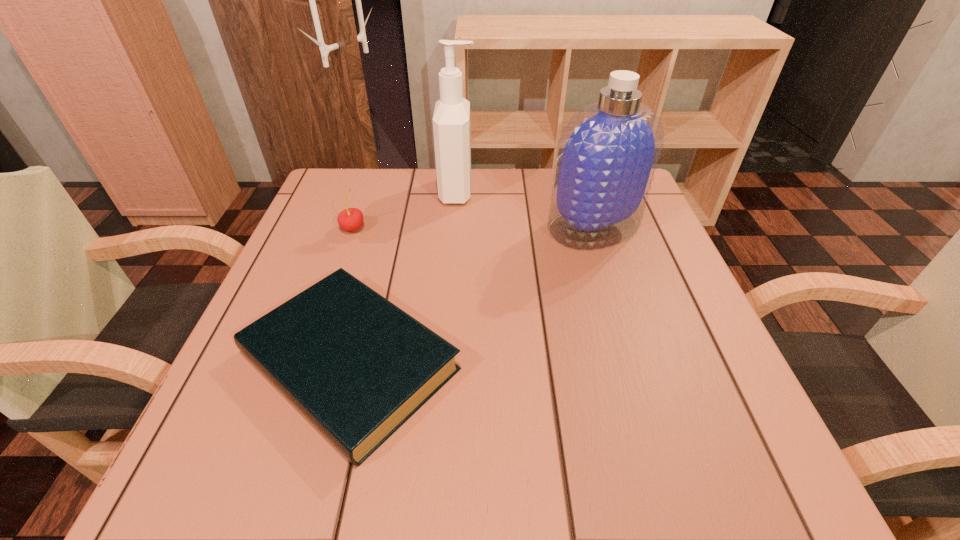
You are a GUI agent. You are given a task and a screenshot of the screen. Output one action in this format:
    pyautogui.click(x=<x>, y=<y>)
    Task: Click on the left cleansing agent
    This screenshot has width=960, height=540.
    Given the screenshot: What is the action you would take?
    pyautogui.click(x=451, y=121)

Where is `the rightmost object`? Image resolution: width=960 pixels, height=540 pixels. the rightmost object is located at coordinates [x=607, y=154].

At what (x,y) coordinates should I click in order to perform the action: click on cherry. Please return your answer as a coordinate pair (x, y). Image resolution: width=960 pixels, height=540 pixels. Looking at the image, I should click on (350, 219).

Locate an element on the screen. Image resolution: width=960 pixels, height=540 pixels. the shortest object is located at coordinates (357, 366).

Image resolution: width=960 pixels, height=540 pixels. I want to click on book, so click(x=357, y=366).

You are a GUI agent. You are given a task and a screenshot of the screen. Output one action in this format:
    pyautogui.click(x=<x>, y=<y>)
    Task: Click on the free space located on the front label of the left cleansing agent
    The height and width of the screenshot is (540, 960).
    Given the screenshot: What is the action you would take?
    pyautogui.click(x=523, y=191)

Find the location of a particular element. The height and width of the screenshot is (540, 960). vacant space located 0.070m on the left of the rightmost object is located at coordinates (515, 227).

This screenshot has width=960, height=540. Identify the location of free space located on the right of the third tallest object. (406, 228).

Find the location of a particular element. free space located 0.370m on the back of the shortest object is located at coordinates (396, 184).

The width and height of the screenshot is (960, 540). What are the coordinates of `cherry present at the far edge` in the screenshot? It's located at (350, 219).